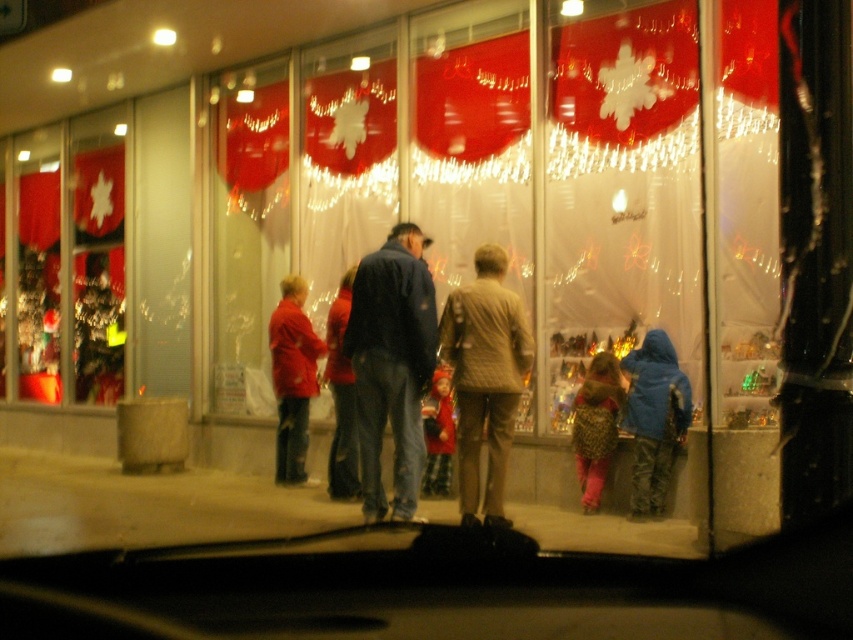
You are a passenger in the car and want to know which clothing item is closer to the window between the dark blue jacket at center and the velvet red coat at center. Which one is closer?

The dark blue jacket at center is closer to the window because it is in front of the velvet red coat at center.

You are a delivery driver who needs to confirm the distance of two points on the storefront window from your current position. The points are labeled as point 1 at coordinates (x=503, y=420) and point 2 at coordinates (x=450, y=384). Which point is closer to you?

Point 1 at coordinates (x=503, y=420) is closer to the camera than point 2 at coordinates (x=450, y=384).

From the picture: You are a passenger in the car and want to know which item is closer to the right side of the window. Which one is the tan quilted jacket at center or the velvet red coat at center?

The tan quilted jacket at center is to the right of the velvet red coat at center, so the tan quilted jacket at center is closer to the right side of the window.